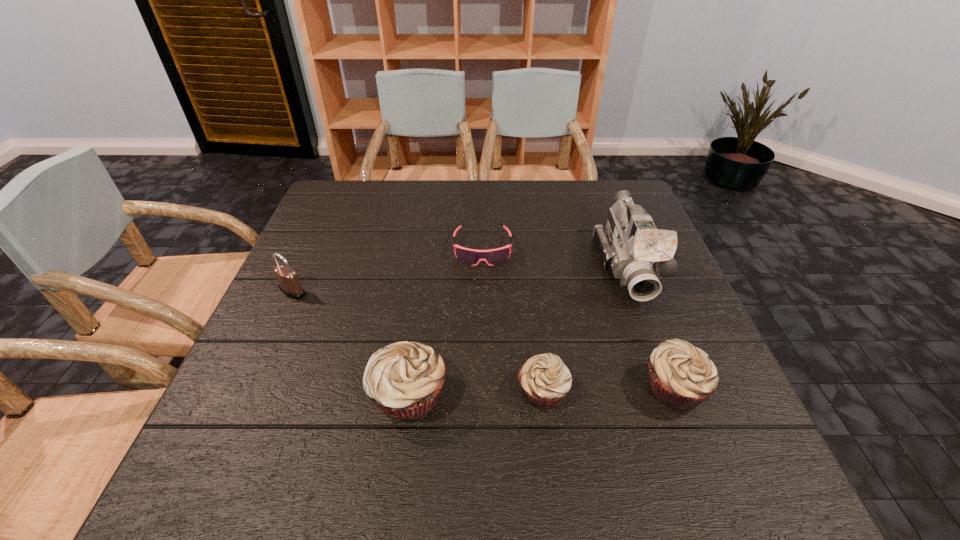
Identify the location of the tallest muffin. (404, 379).

Locate an element on the screen. the shortest muffin is located at coordinates (x=544, y=379).

Locate an element on the screen. This screenshot has height=540, width=960. the fifth tallest object is located at coordinates click(544, 379).

Where is `the rightmost muffin`? Image resolution: width=960 pixels, height=540 pixels. the rightmost muffin is located at coordinates (682, 376).

Identify the location of the second tallest muffin. (682, 376).

The height and width of the screenshot is (540, 960). In order to click on goggles in this screenshot , I will do `click(472, 257)`.

At what (x,y) coordinates should I click in order to perform the action: click on padlock. Please return your answer as a coordinate pair (x, y). This screenshot has height=540, width=960. Looking at the image, I should click on (289, 284).

Identify the location of the tallest object. Image resolution: width=960 pixels, height=540 pixels. (630, 245).

I want to click on blank space located 0.120m on the right of the tallest muffin, so click(x=511, y=395).

I want to click on free space located 0.260m on the back of the second muffin from right to left, so click(529, 282).